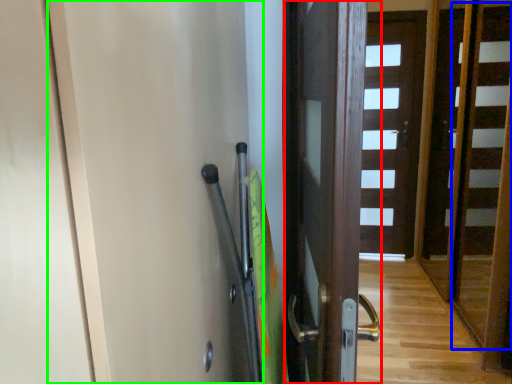
Question: Estimate the real-world distances between objects in this image. Which object is farther from door (highlighted by a red box), stair (highlighted by a blue box) or screen door (highlighted by a green box)?

Choices:
 (A) stair
 (B) screen door

Answer: (A)